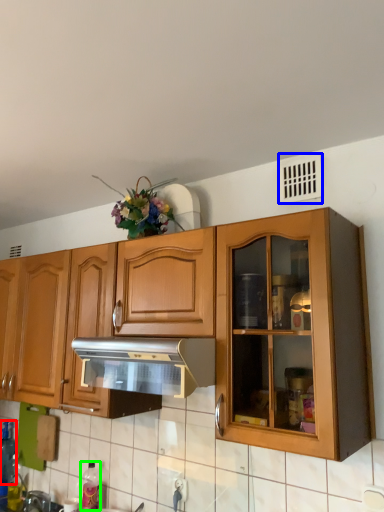
Question: Based on their relative distances, which object is nearer to bottle (highlighted by a red box)? Choose from window (highlighted by a blue box) and bottle (highlighted by a green box).

Choices:
 (A) window
 (B) bottle

Answer: (B)